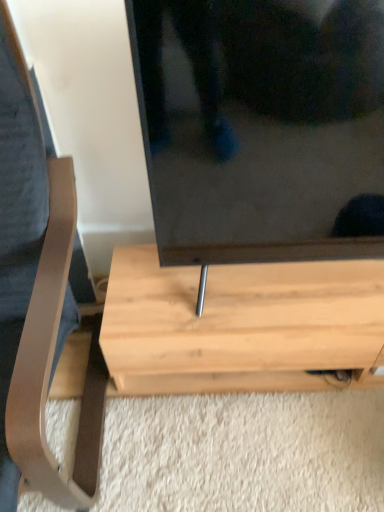
Question: From a real-world perspective, is light brown wood coffee table at left above or below light wood table at center?

Choices:
 (A) above
 (B) below

Answer: (A)

Question: Looking at their shapes, would you say light brown wood coffee table at left is wider or thinner than light wood table at center?

Choices:
 (A) wide
 (B) thin

Answer: (A)

Question: Is light brown wood coffee table at left taller or shorter than light wood table at center?

Choices:
 (A) short
 (B) tall

Answer: (B)

Question: From their relative heights in the image, would you say light wood table at center is taller or shorter than light brown wood coffee table at left?

Choices:
 (A) short
 (B) tall

Answer: (A)

Question: In terms of width, does light wood table at center look wider or thinner when compared to light brown wood coffee table at left?

Choices:
 (A) wide
 (B) thin

Answer: (B)

Question: In the image, is light wood table at center positioned in front of or behind light brown wood coffee table at left?

Choices:
 (A) behind
 (B) front

Answer: (A)

Question: Is point (188, 351) positioned closer to the camera than point (26, 301)?

Choices:
 (A) farther
 (B) closer

Answer: (A)